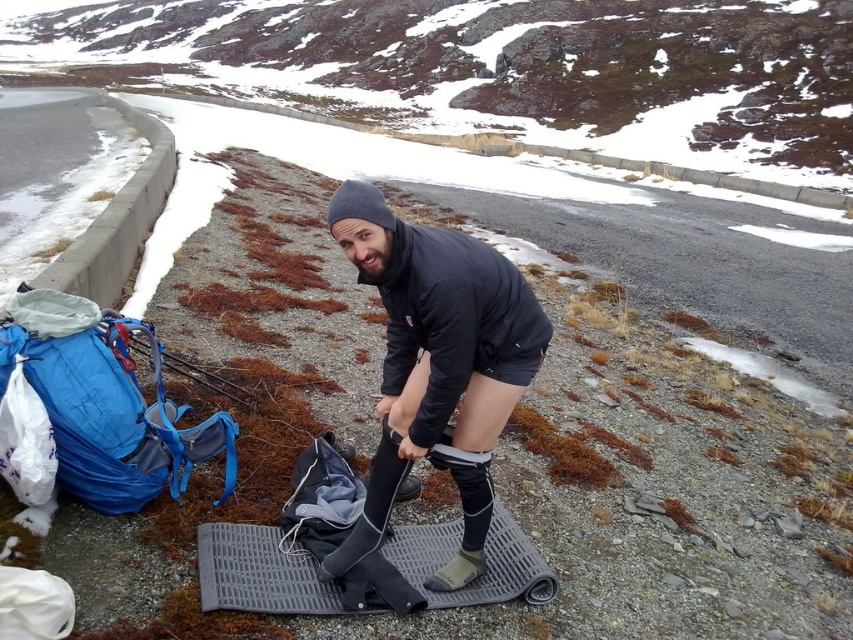
What are the coordinates of the black matte jacket at center in the image?

The black matte jacket at center is located at coordinates point (436, 365).

You are standing in a mountainous area and see two points marked in the scene. Which point, point (491,353) or point (231,572), is closer to you?

Point (491,353) is closer to the viewer than point (231,572).

You are an outdoor guide helping someone set up camp. You see the black matte jacket at center and the gray rubber mat at center. Which object is closer to you?

The black matte jacket at center is closer to you because it is in front of the gray rubber mat at center.